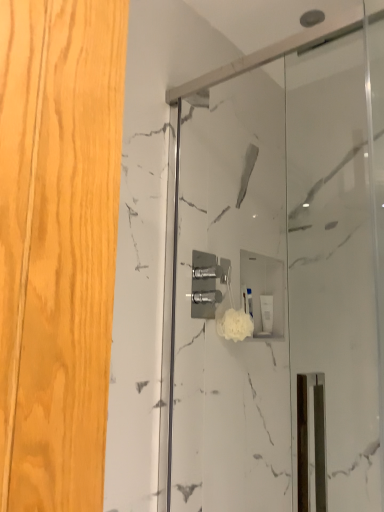
Question: Does white fluffy sponge at center appear on the right side of white matte soap dispenser at center?

Choices:
 (A) no
 (B) yes

Answer: (A)

Question: From the image's perspective, is white fluffy sponge at center below white matte soap dispenser at center?

Choices:
 (A) yes
 (B) no

Answer: (B)

Question: Is white fluffy sponge at center thinner than white matte soap dispenser at center?

Choices:
 (A) no
 (B) yes

Answer: (A)

Question: Is white fluffy sponge at center bigger than white matte soap dispenser at center?

Choices:
 (A) no
 (B) yes

Answer: (B)

Question: Can you confirm if white fluffy sponge at center is smaller than white matte soap dispenser at center?

Choices:
 (A) no
 (B) yes

Answer: (A)

Question: Does white fluffy sponge at center lie behind white matte soap dispenser at center?

Choices:
 (A) no
 (B) yes

Answer: (A)

Question: Is white marble shower door at center touching white fluffy sponge at center?

Choices:
 (A) no
 (B) yes

Answer: (A)

Question: Does white marble shower door at center have a lesser height compared to white fluffy sponge at center?

Choices:
 (A) no
 (B) yes

Answer: (A)

Question: Is white marble shower door at center wider than white fluffy sponge at center?

Choices:
 (A) no
 (B) yes

Answer: (A)

Question: Considering the relative sizes of white marble shower door at center and white fluffy sponge at center in the image provided, is white marble shower door at center taller than white fluffy sponge at center?

Choices:
 (A) yes
 (B) no

Answer: (A)

Question: Is white marble shower door at center aimed at white fluffy sponge at center?

Choices:
 (A) no
 (B) yes

Answer: (A)

Question: From a real-world perspective, is white marble shower door at center physically above white fluffy sponge at center?

Choices:
 (A) yes
 (B) no

Answer: (A)

Question: Is white fluffy sponge at center taller than white marble shower door at center?

Choices:
 (A) yes
 (B) no

Answer: (B)